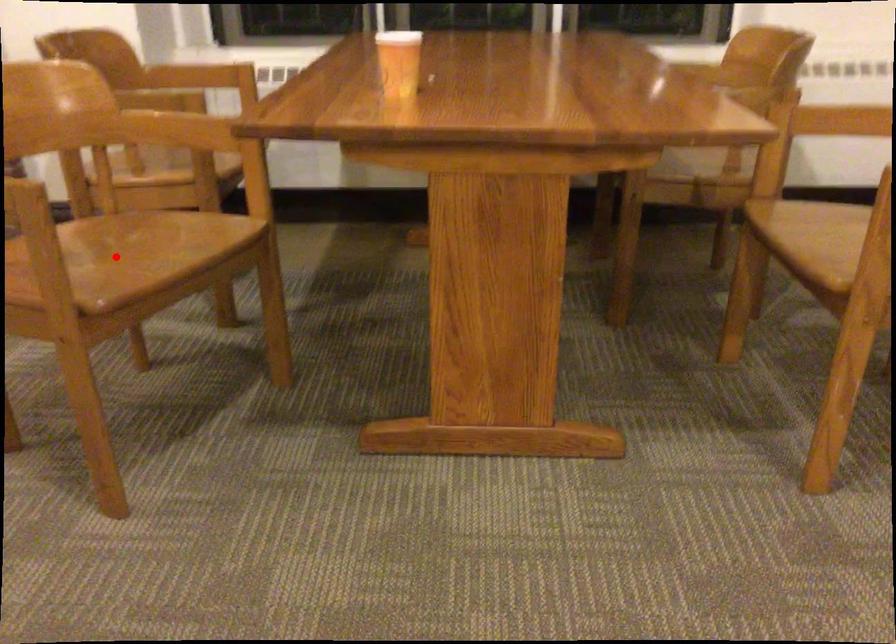
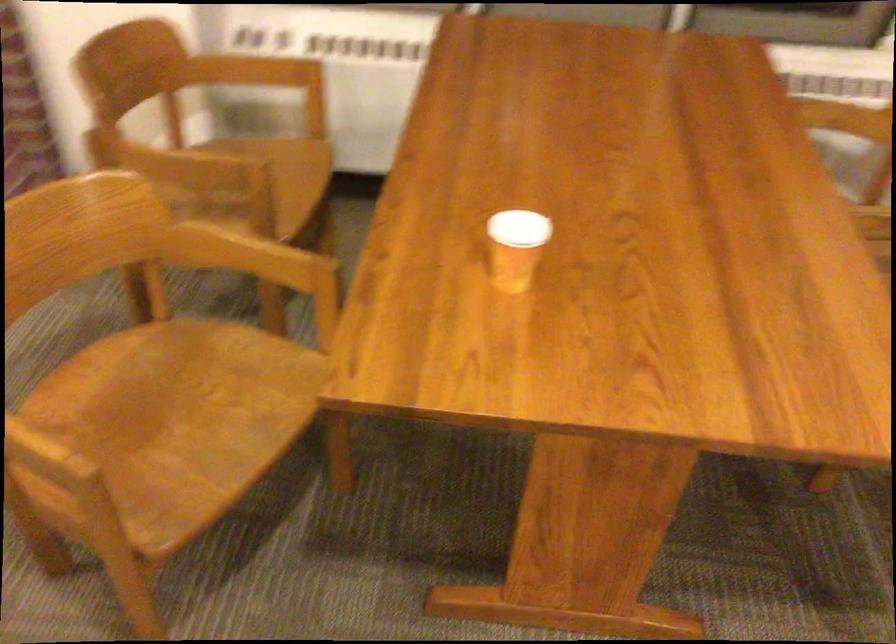
Question: I am providing you with two images of the same scene from different viewpoints. In image1, a red point is highlighted. Considering the same 3D point in image2, which of the following is correct?

Choices:
 (A) It is closer
 (B) It is farther

Answer: (A)